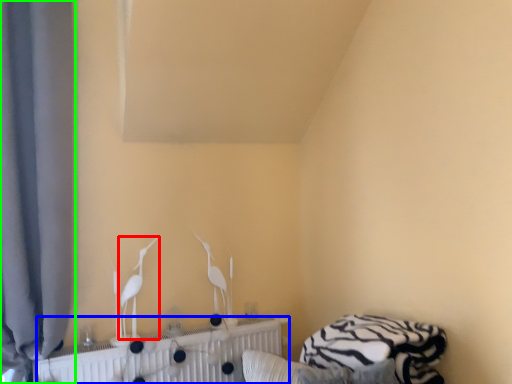
Question: Which object is the farthest from bird (highlighted by a red box)? Choose among these: radiator (highlighted by a blue box) or curtain (highlighted by a green box).

Choices:
 (A) radiator
 (B) curtain

Answer: (B)